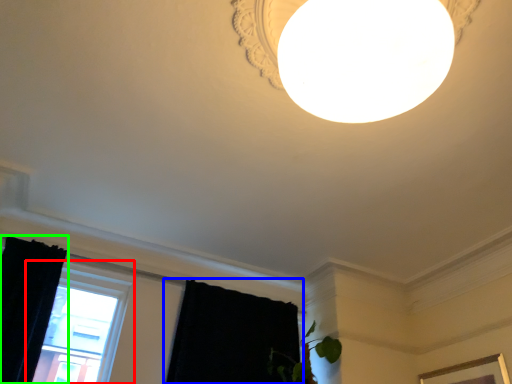
Question: Which object is the closest to the window (highlighted by a red box)? Choose among these: curtain (highlighted by a blue box) or curtain (highlighted by a green box).

Choices:
 (A) curtain
 (B) curtain

Answer: (B)